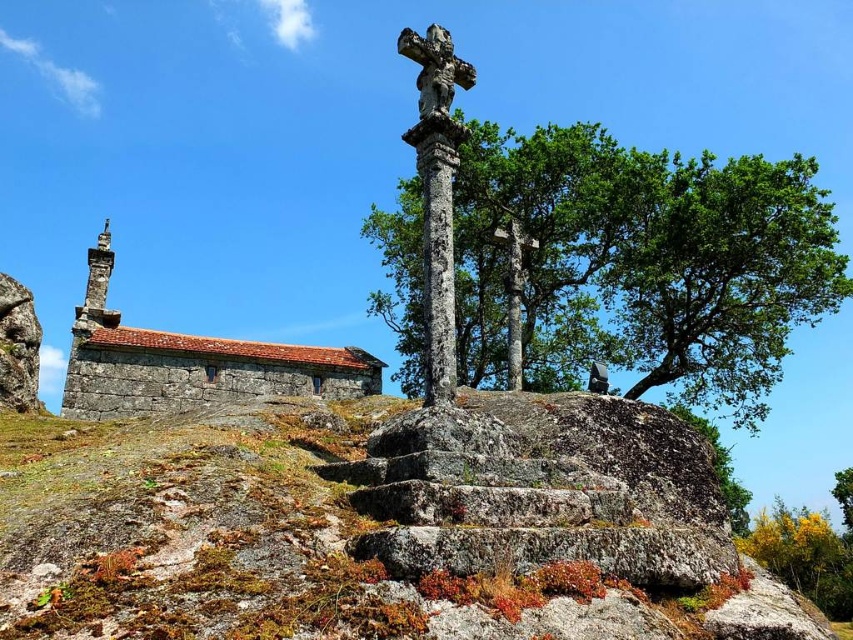
You are a tourist visiting this historic site and want to take a photo of both the rusty stone steps at center and the rustic stone church at left. Which object should you stand closer to in order to capture both in the same frame?

You should stand closer to the rusty stone steps at center because it is smaller than the rustic stone church at left, allowing both to fit within the camera frame more easily when positioned nearer to the smaller object.